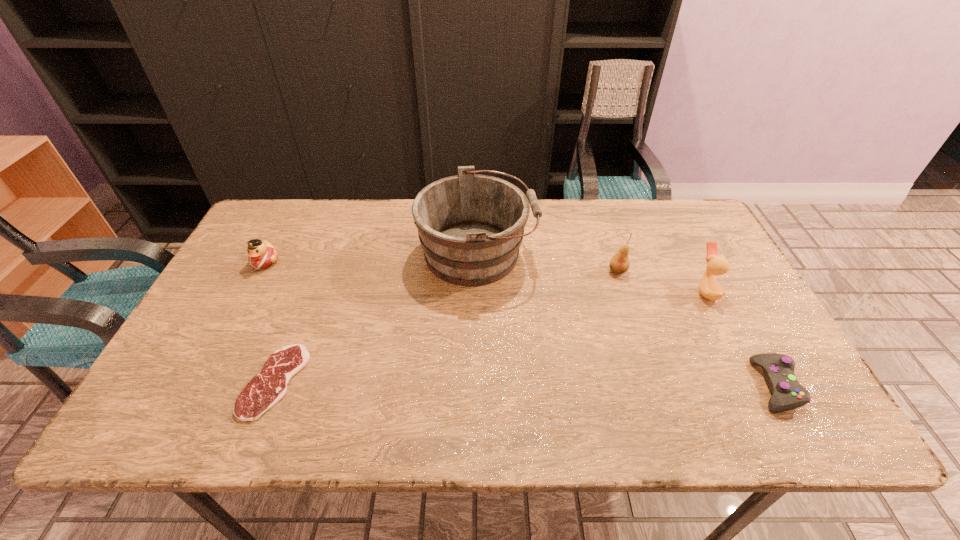
In order to click on vacant area that satisfies the following two spatial constraints: 1. on the front side of the steak; 2. on the right side of the control in this screenshot , I will do `click(273, 386)`.

Identify the location of free space that satisfies the following two spatial constraints: 1. on the beak of the control; 2. on the left side of the nearer duck. (755, 386).

At what (x,y) coordinates should I click in order to perform the action: click on vacant point that satisfies the following two spatial constraints: 1. on the face of the control; 2. on the right side of the left duck. Please return your answer as a coordinate pair (x, y). Looking at the image, I should click on (201, 386).

The height and width of the screenshot is (540, 960). I want to click on free location that satisfies the following two spatial constraints: 1. on the front side of the tallest object; 2. on the left side of the control, so click(476, 386).